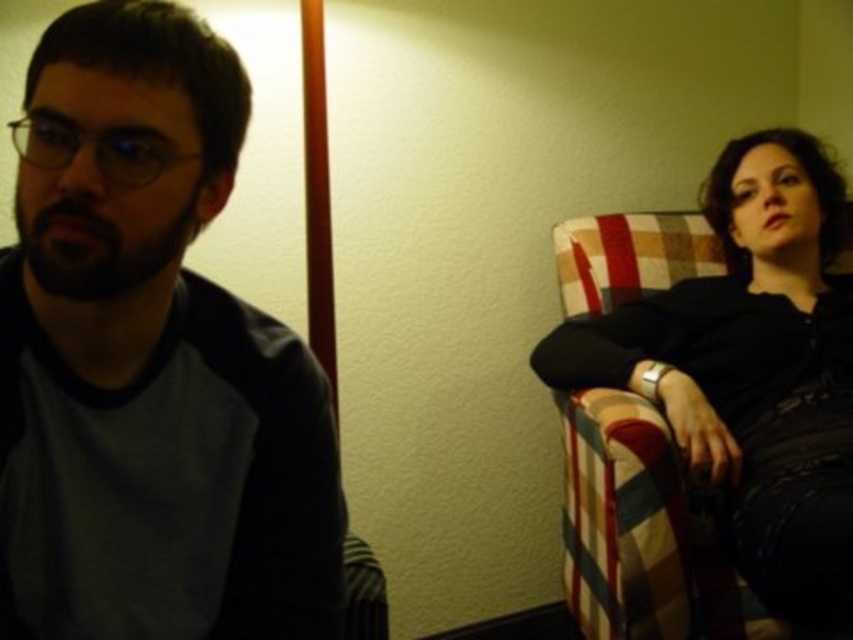
Is matte gray shirt at left bigger than black leather jacket at right?

No.

Which of these two, matte gray shirt at left or black leather jacket at right, stands taller?

Standing taller between the two is black leather jacket at right.

Which is in front, point (183, 388) or point (844, 308)?

Positioned in front is point (183, 388).

Identify the location of matte gray shirt at left. (149, 362).